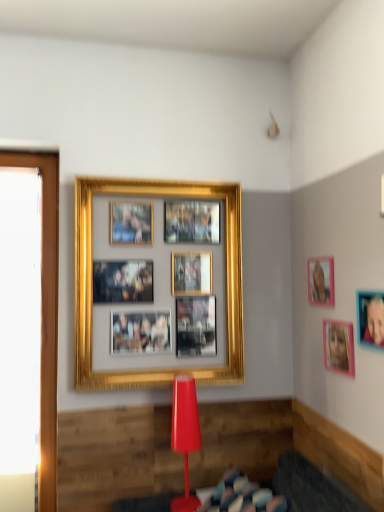
Find the location of a particular element. gold metallic picture frame at upper center, acting as the fourth picture frame starting from the front is located at coordinates [x=92, y=284].

Describe the element at coordinates (286, 490) in the screenshot. I see `rubberized plastic stool at lower center` at that location.

Consider the image. Measure the distance between transparent glass window at left and camera.

transparent glass window at left is 2.09 meters away from camera.

You are a GUI agent. You are given a task and a screenshot of the screen. Output one action in this format:
    pyautogui.click(x=<x>, y=<y>)
    Task: Click on the pink matte picture frame at upper right, which appears as the 2th picture frame when viewed from the front
    The image size is (384, 512).
    Given the screenshot: What is the action you would take?
    pyautogui.click(x=338, y=347)

I want to click on pink matte picture frame at upper right, acting as the 3th picture frame starting from the front, so click(321, 281).

Is pink matte picture frame at upper right, the 2th picture frame when ordered from left to right, positioned far away from transparent glass window at left?

Absolutely, pink matte picture frame at upper right, the 2th picture frame when ordered from left to right, is distant from transparent glass window at left.

From the picture: Is pink matte picture frame at upper right, acting as the 3th picture frame starting from the front, to the right of transparent glass window at left from the viewer's perspective?

Indeed, pink matte picture frame at upper right, acting as the 3th picture frame starting from the front, is positioned on the right side of transparent glass window at left.

Considering the relative sizes of pink matte picture frame at upper right, the 4th picture frame positioned from the left, and matte red table lamp at center in the image provided, is pink matte picture frame at upper right, the 4th picture frame positioned from the left, wider than matte red table lamp at center?

No, pink matte picture frame at upper right, the 4th picture frame positioned from the left, is not wider than matte red table lamp at center.

From the image's perspective, is pink matte picture frame at upper right, positioned as the first picture frame in front-to-back order, positioned above or below matte red table lamp at center?

pink matte picture frame at upper right, positioned as the first picture frame in front-to-back order, is above matte red table lamp at center.

This screenshot has height=512, width=384. There is a matte red table lamp at center. Find the location of `the 2nd picture frame above it (from a real-world perspective)`. the 2nd picture frame above it (from a real-world perspective) is located at coordinates pos(370,318).

Which object is positioned more to the right, matte red table lamp at center or pink matte picture frame at upper right, the 2th picture frame viewed from the right?

pink matte picture frame at upper right, the 2th picture frame viewed from the right.

In terms of width, does matte red table lamp at center look wider or thinner when compared to pink matte picture frame at upper right, the 2th picture frame viewed from the right?

Clearly, matte red table lamp at center has more width compared to pink matte picture frame at upper right, the 2th picture frame viewed from the right.

I want to click on table lamp below the pink matte picture frame at upper right, which appears as the 3th picture frame when viewed from the back (from a real-world perspective), so click(185, 435).

Is matte red table lamp at center shorter than pink matte picture frame at upper right, which appears as the 3th picture frame when viewed from the back?

No.

Where is `window screen located underneath the gold metallic picture frame at upper center, the first picture frame from the back (from a real-world perspective)`? window screen located underneath the gold metallic picture frame at upper center, the first picture frame from the back (from a real-world perspective) is located at coordinates (46, 311).

Is transparent glass window at left turned away from gold metallic picture frame at upper center, acting as the first picture frame starting from the left?

No, transparent glass window at left is not facing away from gold metallic picture frame at upper center, acting as the first picture frame starting from the left.

From the image's perspective, is transparent glass window at left on gold metallic picture frame at upper center, acting as the first picture frame starting from the left?

Actually, transparent glass window at left appears below gold metallic picture frame at upper center, acting as the first picture frame starting from the left, in the image.

Considering the sizes of pink matte picture frame at upper right, the 2th picture frame when ordered from left to right, and gold metallic picture frame at upper center, acting as the fourth picture frame starting from the front, in the image, is pink matte picture frame at upper right, the 2th picture frame when ordered from left to right, wider or thinner than gold metallic picture frame at upper center, acting as the fourth picture frame starting from the front,?

Considering their sizes, pink matte picture frame at upper right, the 2th picture frame when ordered from left to right, looks slimmer than gold metallic picture frame at upper center, acting as the fourth picture frame starting from the front.

Can you tell me how much pink matte picture frame at upper right, acting as the 2th picture frame starting from the back, and gold metallic picture frame at upper center, which is the 4th picture frame from right to left, differ in facing direction?

They differ by 89.6 degrees in their facing directions.

From a real-world perspective, which picture frame is the 1st one underneath the pink matte picture frame at upper right, acting as the 3th picture frame starting from the front? Please provide its 2D coordinates.

[(92, 284)]

Based on the photo, is pink matte picture frame at upper right, which appears as the 3th picture frame when viewed from the right, positioned in front of gold metallic picture frame at upper center, acting as the first picture frame starting from the left?

Yes, it is in front of gold metallic picture frame at upper center, acting as the first picture frame starting from the left.

Is pink matte picture frame at upper right, which appears as the 2th picture frame when viewed from the front, located within transparent glass window at left?

That's incorrect, pink matte picture frame at upper right, which appears as the 2th picture frame when viewed from the front, is not inside transparent glass window at left.

Is point (55, 328) positioned behind point (352, 361)?

Yes, it is behind point (352, 361).

Is transparent glass window at left looking in the opposite direction of pink matte picture frame at upper right, the 2th picture frame viewed from the right?

transparent glass window at left does not have its back to pink matte picture frame at upper right, the 2th picture frame viewed from the right.

Is transparent glass window at left bigger than pink matte picture frame at upper right, which appears as the 2th picture frame when viewed from the front?

Indeed, transparent glass window at left has a larger size compared to pink matte picture frame at upper right, which appears as the 2th picture frame when viewed from the front.

From a real-world perspective, is matte red table lamp at center under rubberized plastic stool at lower center?

No, from a real-world perspective, matte red table lamp at center is not below rubberized plastic stool at lower center.

Considering their positions, is matte red table lamp at center located in front of or behind rubberized plastic stool at lower center?

matte red table lamp at center is positioned farther from the viewer than rubberized plastic stool at lower center.

Can you confirm if matte red table lamp at center is thinner than rubberized plastic stool at lower center?

Yes, matte red table lamp at center is thinner than rubberized plastic stool at lower center.

Is point (186, 431) closer to viewer compared to point (311, 489)?

No.

At what (x,y) coordinates should I click in order to perform the action: click on window screen that appears below the pink matte picture frame at upper right, which appears as the 3th picture frame when viewed from the right (from the image's perspective). Please return your answer as a coordinate pair (x, y). Looking at the image, I should click on (46, 311).

Locate an element on the screen. Image resolution: width=384 pixels, height=512 pixels. table lamp on the left side of pink matte picture frame at upper right, positioned as the first picture frame in front-to-back order is located at coordinates (185, 435).

Based on their spatial positions, is rubberized plastic stool at lower center or transparent glass window at left closer to pink matte picture frame at upper right, which appears as the 3th picture frame when viewed from the back?

Among the two, rubberized plastic stool at lower center is located nearer to pink matte picture frame at upper right, which appears as the 3th picture frame when viewed from the back.

Considering their positions, is gold metallic picture frame at upper center, acting as the first picture frame starting from the left, positioned further to pink matte picture frame at upper right, acting as the 2th picture frame starting from the back, than rubberized plastic stool at lower center?

Based on the image, rubberized plastic stool at lower center appears to be further to pink matte picture frame at upper right, acting as the 2th picture frame starting from the back.

Looking at the image, which one is located closer to pink matte picture frame at upper right, positioned as the first picture frame in front-to-back order, pink matte picture frame at upper right, which appears as the 3th picture frame when viewed from the back, or rubberized plastic stool at lower center?

pink matte picture frame at upper right, which appears as the 3th picture frame when viewed from the back.

From the image, which object appears to be nearer to rubberized plastic stool at lower center, transparent glass window at left or pink matte picture frame at upper right, positioned as the first picture frame in front-to-back order?

pink matte picture frame at upper right, positioned as the first picture frame in front-to-back order.

Looking at the image, which one is located closer to pink matte picture frame at upper right, the fourth picture frame in the back-to-front sequence, gold metallic picture frame at upper center, the first picture frame from the back, or rubberized plastic stool at lower center?

rubberized plastic stool at lower center lies closer to pink matte picture frame at upper right, the fourth picture frame in the back-to-front sequence, than the other object.

From the picture: Based on their spatial positions, is matte red table lamp at center or pink matte picture frame at upper right, acting as the 3th picture frame starting from the front, closer to transparent glass window at left?

The object closer to transparent glass window at left is matte red table lamp at center.

Considering their positions, is pink matte picture frame at upper right, acting as the 3th picture frame starting from the front, positioned further to transparent glass window at left than gold metallic picture frame at upper center, acting as the first picture frame starting from the left?

pink matte picture frame at upper right, acting as the 3th picture frame starting from the front, lies further to transparent glass window at left than the other object.

From the image, which object appears to be farther from pink matte picture frame at upper right, which is the 3th picture frame from left to right, gold metallic picture frame at upper center, which is the 4th picture frame from right to left, or matte red table lamp at center?

Among the two, gold metallic picture frame at upper center, which is the 4th picture frame from right to left, is located further to pink matte picture frame at upper right, which is the 3th picture frame from left to right.

The height and width of the screenshot is (512, 384). I want to click on picture frame between transparent glass window at left and pink matte picture frame at upper right, acting as the 2th picture frame starting from the back, in the horizontal direction, so click(92, 284).

At what (x,y) coordinates should I click in order to perform the action: click on furniture between transparent glass window at left and pink matte picture frame at upper right, the 2th picture frame viewed from the right. Please return your answer as a coordinate pair (x, y). The image size is (384, 512). Looking at the image, I should click on (286, 490).

Image resolution: width=384 pixels, height=512 pixels. I want to click on table lamp between gold metallic picture frame at upper center, which is the 4th picture frame from right to left, and rubberized plastic stool at lower center from top to bottom, so click(x=185, y=435).

The width and height of the screenshot is (384, 512). I want to click on table lamp between transparent glass window at left and pink matte picture frame at upper right, which appears as the 3th picture frame when viewed from the right, in the horizontal direction, so click(185, 435).